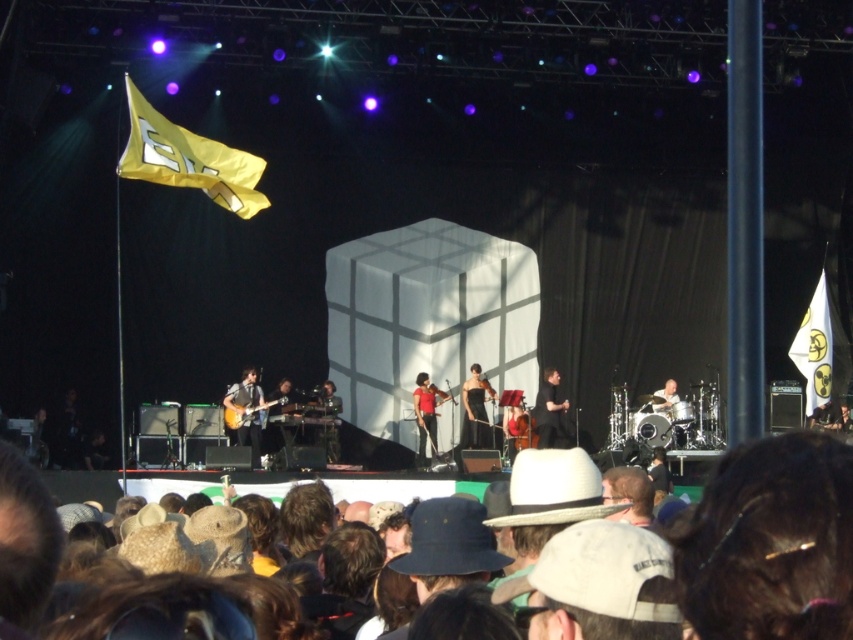
Is yellow fabric flag at upper left thinner than black matte dress at center?

In fact, yellow fabric flag at upper left might be wider than black matte dress at center.

Who is more distant from viewer, (190, 157) or (538, 394)?

The point (538, 394) is behind.

This screenshot has height=640, width=853. What do you see at coordinates (187, 157) in the screenshot? I see `yellow fabric flag at upper left` at bounding box center [187, 157].

Where is `yellow fabric flag at upper left`? This screenshot has width=853, height=640. yellow fabric flag at upper left is located at coordinates click(x=187, y=157).

What do you see at coordinates (761, 547) in the screenshot? I see `brown straw hat at lower center` at bounding box center [761, 547].

Describe the element at coordinates (761, 547) in the screenshot. I see `brown straw hat at lower center` at that location.

This screenshot has width=853, height=640. I want to click on brown straw hat at lower center, so click(761, 547).

Does white fabric flag at right have a lesser height compared to wooden electric guitar at center?

No, white fabric flag at right is not shorter than wooden electric guitar at center.

Identify the location of white fabric flag at right. This screenshot has width=853, height=640. (814, 348).